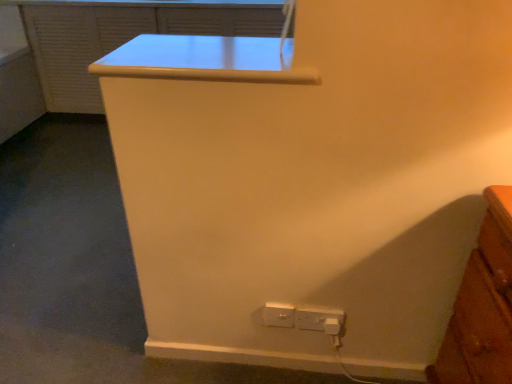
This screenshot has width=512, height=384. Identify the location of white plastic power plugs and sockets at lower right, which is counted as the first power plugs and sockets, starting from the right. (316, 317).

This screenshot has width=512, height=384. In order to click on matte white file cabinet at upper center in this screenshot , I will do `click(124, 36)`.

Is white glossy table at upper center at the left side of white plastic power plugs and sockets at lower center, positioned as the second power plugs and sockets in right-to-left order?

Yes, white glossy table at upper center is to the left of white plastic power plugs and sockets at lower center, positioned as the second power plugs and sockets in right-to-left order.

Which of these two, white glossy table at upper center or white plastic power plugs and sockets at lower center, positioned as the second power plugs and sockets in right-to-left order, is smaller?

With smaller size is white plastic power plugs and sockets at lower center, positioned as the second power plugs and sockets in right-to-left order.

From the image's perspective, does white glossy table at upper center appear higher than white plastic power plugs and sockets at lower center, positioned as the second power plugs and sockets in right-to-left order?

Yes, from the image's perspective, white glossy table at upper center is over white plastic power plugs and sockets at lower center, positioned as the second power plugs and sockets in right-to-left order.

Looking at this image, how far apart are white glossy table at upper center and white plastic power plugs and sockets at lower center, acting as the first power plugs and sockets starting from the left?

white glossy table at upper center is 30.39 inches from white plastic power plugs and sockets at lower center, acting as the first power plugs and sockets starting from the left.

Considering the sizes of objects white plastic power plugs and sockets at lower right, which is counted as the second power plugs and sockets, starting from the left, and matte white file cabinet at upper center in the image provided, who is bigger, white plastic power plugs and sockets at lower right, which is counted as the second power plugs and sockets, starting from the left, or matte white file cabinet at upper center?

With larger size is matte white file cabinet at upper center.

From the image's perspective, between white plastic power plugs and sockets at lower right, which is counted as the second power plugs and sockets, starting from the left, and matte white file cabinet at upper center, which one is located above?

matte white file cabinet at upper center, from the image's perspective.

Considering the sizes of objects white plastic power plugs and sockets at lower right, which is counted as the first power plugs and sockets, starting from the right, and matte white file cabinet at upper center in the image provided, who is shorter, white plastic power plugs and sockets at lower right, which is counted as the first power plugs and sockets, starting from the right, or matte white file cabinet at upper center?

With less height is white plastic power plugs and sockets at lower right, which is counted as the first power plugs and sockets, starting from the right.

Could you tell me if white plastic power plugs and sockets at lower right, which is counted as the second power plugs and sockets, starting from the left, is turned towards matte white file cabinet at upper center?

No, white plastic power plugs and sockets at lower right, which is counted as the second power plugs and sockets, starting from the left, is not facing towards matte white file cabinet at upper center.

Is point (61, 61) in front of point (240, 74)?

No, (61, 61) is behind (240, 74).

Does matte white file cabinet at upper center appear on the left side of white glossy table at upper center?

Indeed, matte white file cabinet at upper center is positioned on the left side of white glossy table at upper center.

How many degrees apart are the facing directions of matte white file cabinet at upper center and white glossy table at upper center?

The facing directions of matte white file cabinet at upper center and white glossy table at upper center are 89.9 degrees apart.

Is matte white file cabinet at upper center outside of white plastic power plugs and sockets at lower center, positioned as the second power plugs and sockets in right-to-left order?

matte white file cabinet at upper center is positioned outside white plastic power plugs and sockets at lower center, positioned as the second power plugs and sockets in right-to-left order.

Find the location of a particular element. The image size is (512, 384). file cabinet that is above the white plastic power plugs and sockets at lower center, acting as the first power plugs and sockets starting from the left (from the image's perspective) is located at coordinates (124, 36).

Looking at the image, does matte white file cabinet at upper center seem bigger or smaller compared to white plastic power plugs and sockets at lower center, acting as the first power plugs and sockets starting from the left?

Considering their sizes, matte white file cabinet at upper center takes up more space than white plastic power plugs and sockets at lower center, acting as the first power plugs and sockets starting from the left.

Does matte white file cabinet at upper center have a lesser width compared to white plastic power plugs and sockets at lower center, acting as the first power plugs and sockets starting from the left?

In fact, matte white file cabinet at upper center might be wider than white plastic power plugs and sockets at lower center, acting as the first power plugs and sockets starting from the left.

Is white plastic power plugs and sockets at lower center, positioned as the second power plugs and sockets in right-to-left order, turned away from white glossy table at upper center?

No.

Is white plastic power plugs and sockets at lower center, positioned as the second power plugs and sockets in right-to-left order, not within white glossy table at upper center?

white plastic power plugs and sockets at lower center, positioned as the second power plugs and sockets in right-to-left order, is positioned outside white glossy table at upper center.

Is white plastic power plugs and sockets at lower center, positioned as the second power plugs and sockets in right-to-left order, taller or shorter than white glossy table at upper center?

In the image, white plastic power plugs and sockets at lower center, positioned as the second power plugs and sockets in right-to-left order, appears to be taller than white glossy table at upper center.

Does white plastic power plugs and sockets at lower center, positioned as the second power plugs and sockets in right-to-left order, appear on the left side of white glossy table at upper center?

In fact, white plastic power plugs and sockets at lower center, positioned as the second power plugs and sockets in right-to-left order, is to the right of white glossy table at upper center.

In the scene shown: Does white plastic power plugs and sockets at lower center, positioned as the second power plugs and sockets in right-to-left order, appear on the left side of matte white file cabinet at upper center?

Incorrect, white plastic power plugs and sockets at lower center, positioned as the second power plugs and sockets in right-to-left order, is not on the left side of matte white file cabinet at upper center.

From a real-world perspective, between white plastic power plugs and sockets at lower center, positioned as the second power plugs and sockets in right-to-left order, and matte white file cabinet at upper center, who is vertically lower?

white plastic power plugs and sockets at lower center, positioned as the second power plugs and sockets in right-to-left order, is physically lower.

From their relative heights in the image, would you say white plastic power plugs and sockets at lower center, positioned as the second power plugs and sockets in right-to-left order, is taller or shorter than matte white file cabinet at upper center?

In the image, white plastic power plugs and sockets at lower center, positioned as the second power plugs and sockets in right-to-left order, appears to be shorter than matte white file cabinet at upper center.

Is white plastic power plugs and sockets at lower center, positioned as the second power plugs and sockets in right-to-left order, facing towards matte white file cabinet at upper center?

No, white plastic power plugs and sockets at lower center, positioned as the second power plugs and sockets in right-to-left order, is not turned towards matte white file cabinet at upper center.

Does white glossy table at upper center turn towards white plastic power plugs and sockets at lower right, which is counted as the second power plugs and sockets, starting from the left?

No, white glossy table at upper center does not turn towards white plastic power plugs and sockets at lower right, which is counted as the second power plugs and sockets, starting from the left.

From a real-world perspective, which object rests below the other?

white plastic power plugs and sockets at lower right, which is counted as the second power plugs and sockets, starting from the left, is physically lower.

From the image's perspective, who appears lower, white glossy table at upper center or white plastic power plugs and sockets at lower right, which is counted as the first power plugs and sockets, starting from the right?

white plastic power plugs and sockets at lower right, which is counted as the first power plugs and sockets, starting from the right.

The height and width of the screenshot is (384, 512). Identify the location of table located above the white plastic power plugs and sockets at lower center, positioned as the second power plugs and sockets in right-to-left order (from the image's perspective). coord(201,58).

Locate an element on the screen. This screenshot has height=384, width=512. file cabinet positioned vertically above the white plastic power plugs and sockets at lower right, which is counted as the first power plugs and sockets, starting from the right (from a real-world perspective) is located at coordinates (124, 36).

Looking at the image, which one is located further to white plastic power plugs and sockets at lower right, which is counted as the second power plugs and sockets, starting from the left, white plastic power plugs and sockets at lower center, positioned as the second power plugs and sockets in right-to-left order, or white glossy table at upper center?

The object further to white plastic power plugs and sockets at lower right, which is counted as the second power plugs and sockets, starting from the left, is white glossy table at upper center.

When comparing their distances from white glossy table at upper center, does white plastic power plugs and sockets at lower center, positioned as the second power plugs and sockets in right-to-left order, or white plastic power plugs and sockets at lower right, which is counted as the first power plugs and sockets, starting from the right, seem further?

Based on the image, white plastic power plugs and sockets at lower right, which is counted as the first power plugs and sockets, starting from the right, appears to be further to white glossy table at upper center.

From the image, which object appears to be farther from matte white file cabinet at upper center, white plastic power plugs and sockets at lower right, which is counted as the second power plugs and sockets, starting from the left, or white glossy table at upper center?

white plastic power plugs and sockets at lower right, which is counted as the second power plugs and sockets, starting from the left, lies further to matte white file cabinet at upper center than the other object.

From the image, which object appears to be farther from white glossy table at upper center, matte white file cabinet at upper center or white plastic power plugs and sockets at lower center, positioned as the second power plugs and sockets in right-to-left order?

The object further to white glossy table at upper center is matte white file cabinet at upper center.

Considering their positions, is white plastic power plugs and sockets at lower center, acting as the first power plugs and sockets starting from the left, positioned closer to matte white file cabinet at upper center than white glossy table at upper center?

white glossy table at upper center is positioned closer to the anchor matte white file cabinet at upper center.

Based on their spatial positions, is matte white file cabinet at upper center or white glossy table at upper center further from white plastic power plugs and sockets at lower center, positioned as the second power plugs and sockets in right-to-left order?

The object further to white plastic power plugs and sockets at lower center, positioned as the second power plugs and sockets in right-to-left order, is matte white file cabinet at upper center.

Looking at the image, which one is located closer to white plastic power plugs and sockets at lower center, acting as the first power plugs and sockets starting from the left, white glossy table at upper center or matte white file cabinet at upper center?

Based on the image, white glossy table at upper center appears to be nearer to white plastic power plugs and sockets at lower center, acting as the first power plugs and sockets starting from the left.

From the image, which object appears to be nearer to white plastic power plugs and sockets at lower center, positioned as the second power plugs and sockets in right-to-left order, white glossy table at upper center or white plastic power plugs and sockets at lower right, which is counted as the first power plugs and sockets, starting from the right?

white plastic power plugs and sockets at lower right, which is counted as the first power plugs and sockets, starting from the right, is closer to white plastic power plugs and sockets at lower center, positioned as the second power plugs and sockets in right-to-left order.

The image size is (512, 384). I want to click on power plugs and sockets between white glossy table at upper center and white plastic power plugs and sockets at lower right, which is counted as the second power plugs and sockets, starting from the left, in the vertical direction, so click(x=278, y=315).

Where is `power plugs and sockets between matte white file cabinet at upper center and white plastic power plugs and sockets at lower right, which is counted as the first power plugs and sockets, starting from the right, in the vertical direction`? power plugs and sockets between matte white file cabinet at upper center and white plastic power plugs and sockets at lower right, which is counted as the first power plugs and sockets, starting from the right, in the vertical direction is located at coordinates (278, 315).